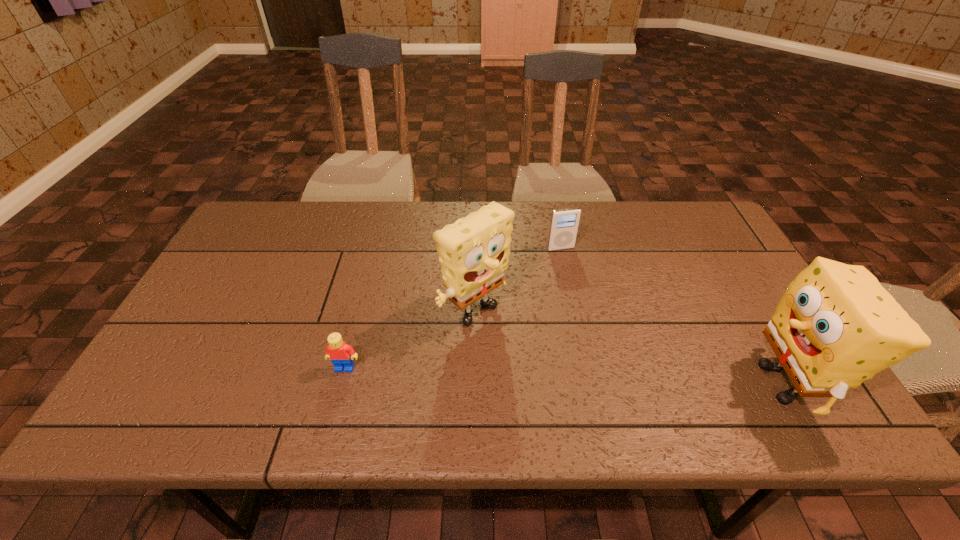
Locate an element on the screen. The width and height of the screenshot is (960, 540). vacant space on the desktop that is between the shortest object and the rightmost object and is positioned on the face of the left sponge is located at coordinates (543, 375).

Where is `vacant space on the desktop that is between the leftmost object and the right sponge and is positioned on the front-facing side of the iPod`? vacant space on the desktop that is between the leftmost object and the right sponge and is positioned on the front-facing side of the iPod is located at coordinates (625, 377).